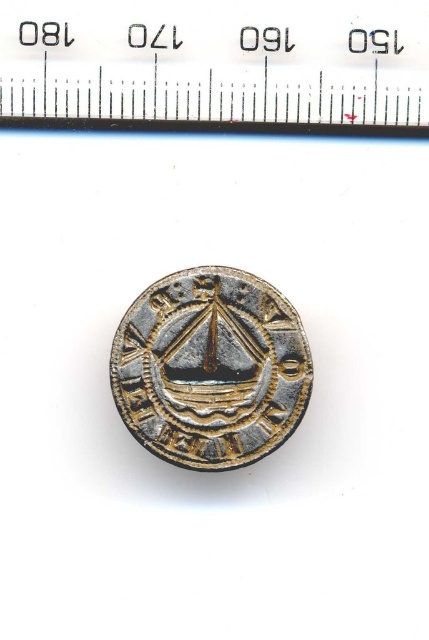
You are an archaeologist examining the image of the metallic ruler at upper center and the gold plated coin at center. Based on the ruler, can you determine if the coin is larger than the ruler?

The metallic ruler at upper center is shorter than the gold plated coin at center, so yes, the coin is larger than the ruler.

You are an archaeologist examining the image of an ancient medallion. You notice a point marked at coordinates (215, 61). What object is located at this point?

The metallic ruler at upper center is located at point (215, 61).